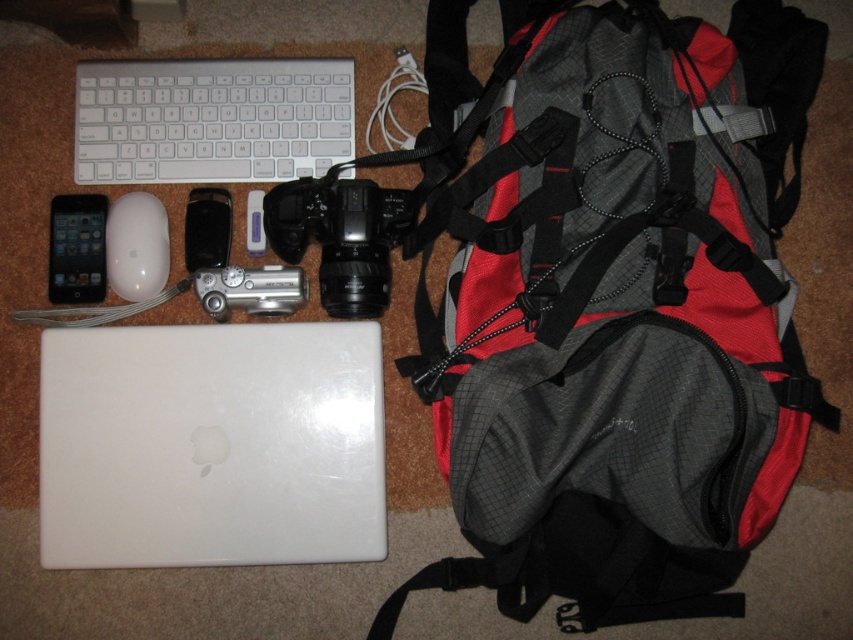
You are packing for a trip and need to place the white matte mouse at upper left and the black matte ipod at upper left into a small pouch. Which item should you place first to ensure they both fit?

You should place the white matte mouse at upper left first since it is to the left of the black matte ipod at upper left, indicating it might be smaller and easier to fit first.

You are packing for a trip and need to place the silver metallic camera at center and the matte black phone at left into a small pouch. Which item should you place first to ensure both fit properly?

The silver metallic camera at center is above the matte black phone at left, so you should place the matte black phone at left first to make room for the camera above it.

You are packing for a trip and have a small rectangular pouch that can only fit items narrower than the white matte mouse at upper left. You want to place the white matte laptop at center into the pouch. Based on their widths, will it fit?

The white matte laptop at center is wider than the white matte mouse at upper left, so it will not fit into the pouch designed for items narrower than the mouse.